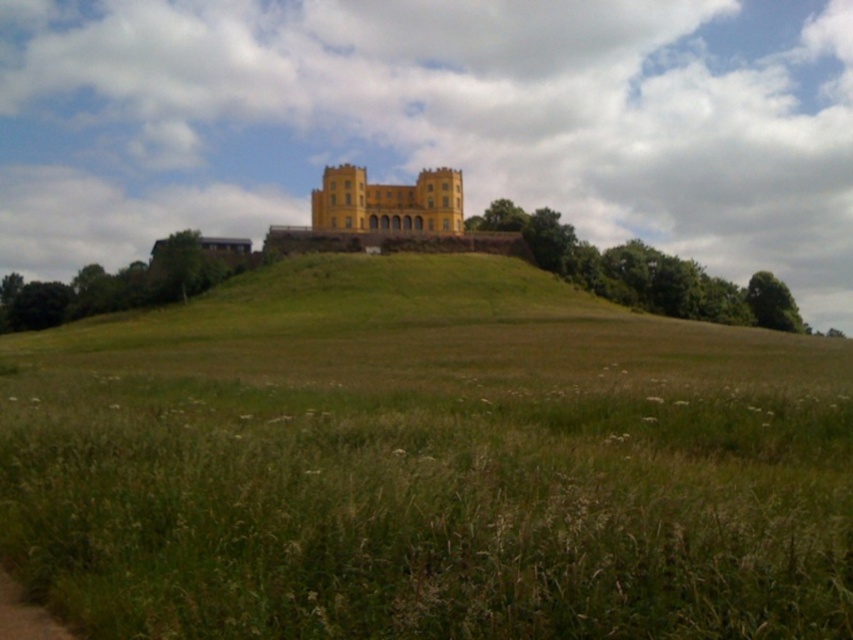
Question: Does green grassy hill at upper center appear on the left side of yellow matte building at center?

Choices:
 (A) yes
 (B) no

Answer: (B)

Question: Does green grassy hill at upper center appear over brown dirt path at lower left?

Choices:
 (A) yes
 (B) no

Answer: (A)

Question: Which object appears farthest from the camera in this image?

Choices:
 (A) yellow matte building at center
 (B) green grassy hill at upper center

Answer: (A)

Question: Does yellow matte building at center appear on the left side of brown dirt path at lower left?

Choices:
 (A) yes
 (B) no

Answer: (A)

Question: Which of the following is the closest to the observer?

Choices:
 (A) (434, 284)
 (B) (378, 186)

Answer: (A)

Question: Estimate the real-world distances between objects in this image. Which object is farther from the brown dirt path at lower left?

Choices:
 (A) green grassy hill at upper center
 (B) yellow matte building at center

Answer: (B)